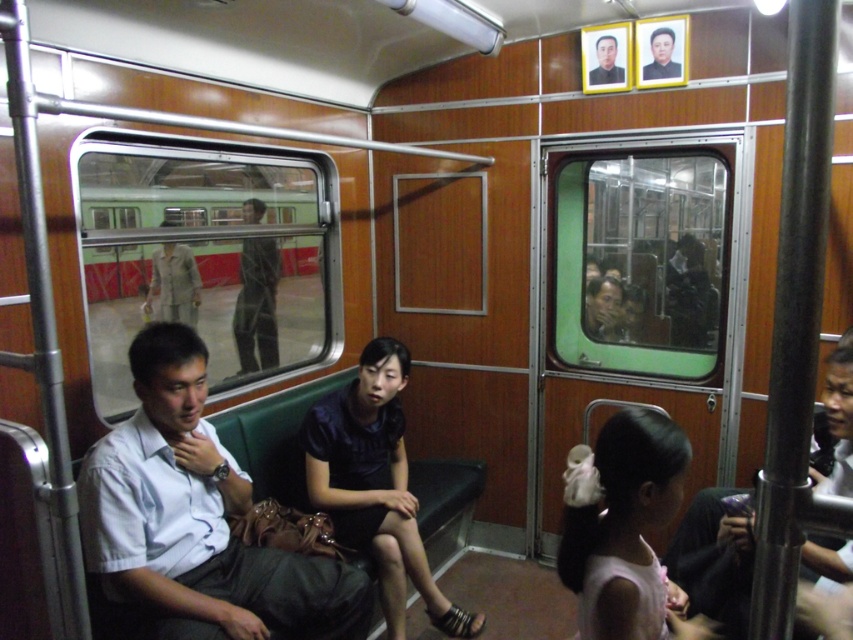
You are a passenger in the subway car and notice two items in the scene. One is the pink fabric hairband at lower right and the other is the black glossy portrait at upper right. Which of these two items is larger in size?

The pink fabric hairband at lower right is bigger than the black glossy portrait at upper right.

You are a passenger on this subway car and want to give a magazine to the person wearing the dark blue satin dress at center. The magazine is currently on the seat next to the pink fabric hairband at lower right. Can you reach the magazine without moving from your seat?

The dark blue satin dress at center is to the left of the pink fabric hairband at lower right. Since the magazine is next to the pink fabric hairband at lower right, the person wearing the dark blue satin dress at center would need to reach to their right to get it, which may be possible depending on the distance between them.